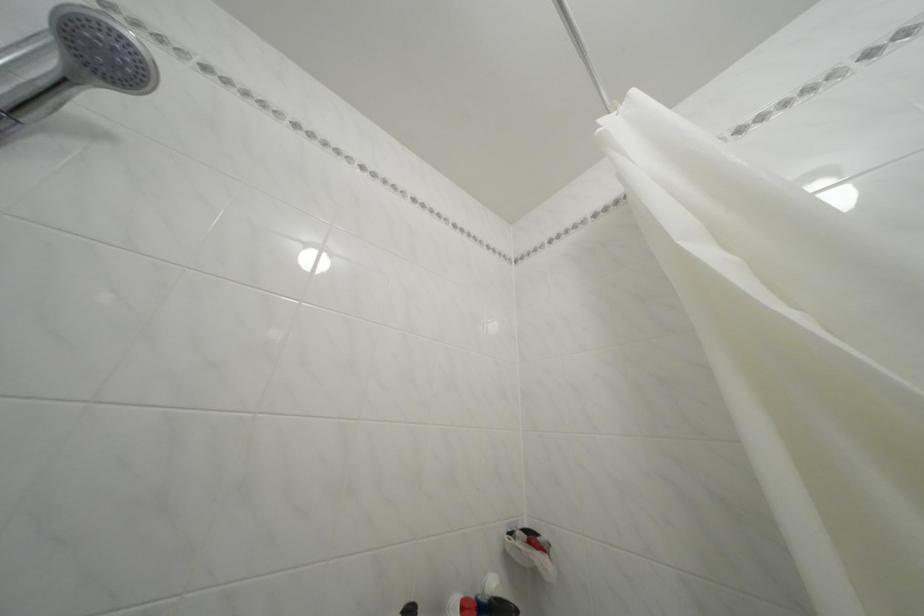
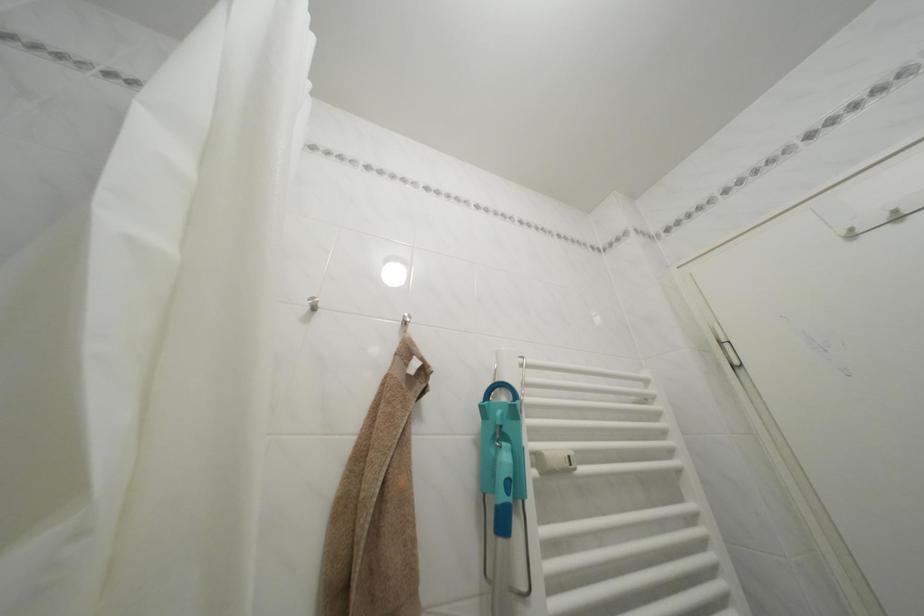
How did the camera likely rotate?

The rotation direction of the camera is right-up.